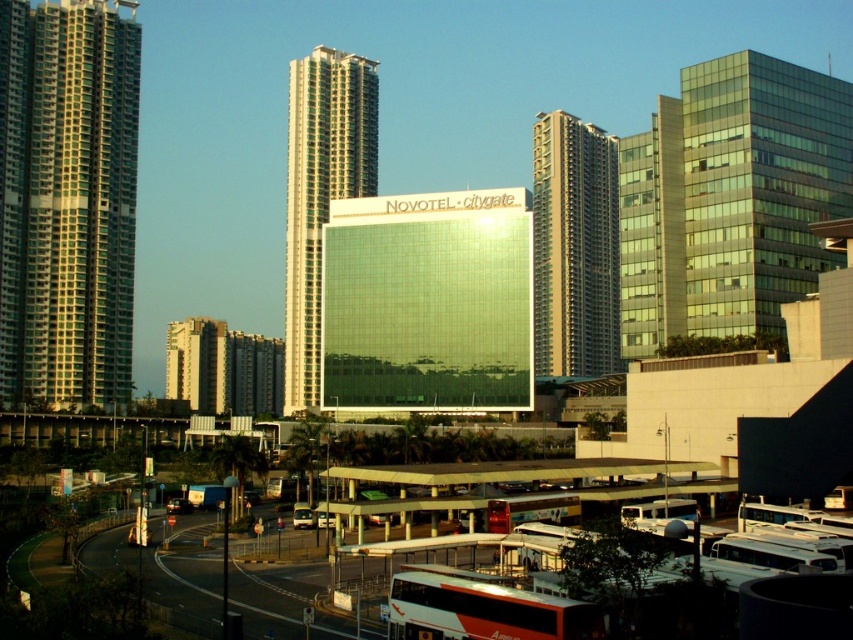
Question: Among these objects, which one is nearest to the camera?

Choices:
 (A) white glossy bus at lower center
 (B) white plastic bus at lower center

Answer: (A)

Question: Which of the following is the farthest from the observer?

Choices:
 (A) (656, 216)
 (B) (13, 36)
 (C) (596, 612)

Answer: (B)

Question: In this image, where is green glass building at left located relative to green glass building at right?

Choices:
 (A) below
 (B) above

Answer: (B)

Question: Can you confirm if light beige concrete building at left is smaller than red matte bus at center?

Choices:
 (A) no
 (B) yes

Answer: (A)

Question: Does green glass building at center lie in front of red matte bus at center?

Choices:
 (A) no
 (B) yes

Answer: (A)

Question: Which point is farther from the camera taking this photo?

Choices:
 (A) (509, 522)
 (B) (764, 300)
 (C) (177, 349)
 (D) (314, 244)

Answer: (C)